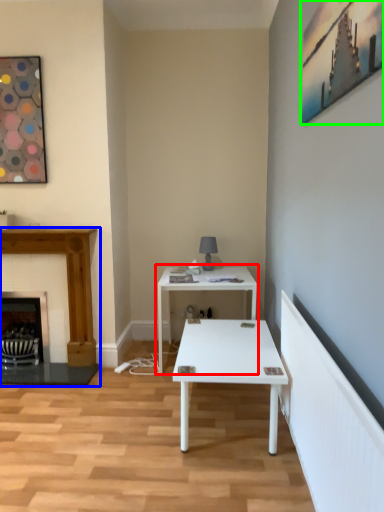
Question: Based on their relative distances, which object is nearer to table (highlighted by a red box)? Choose from fireplace (highlighted by a blue box) and picture frame (highlighted by a green box).

Choices:
 (A) fireplace
 (B) picture frame

Answer: (A)